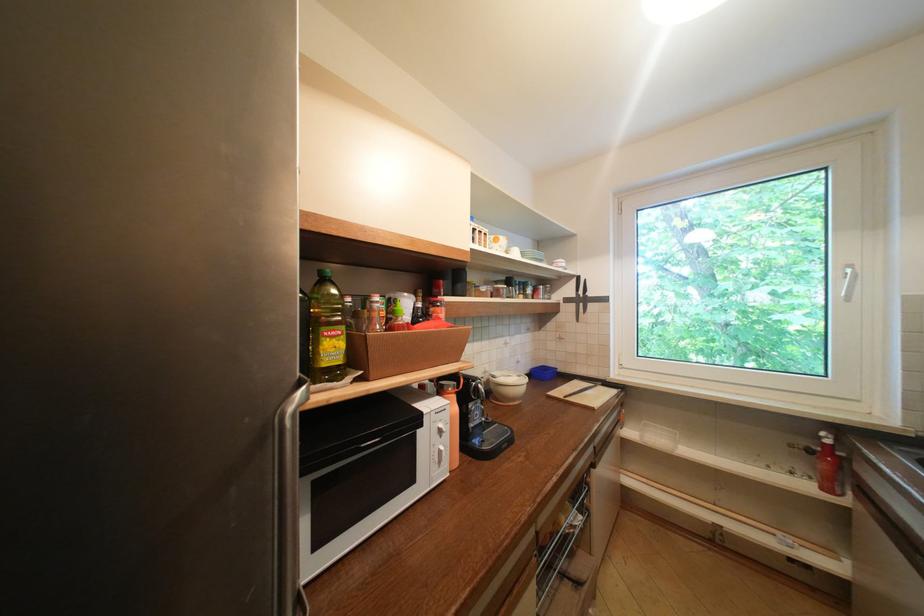
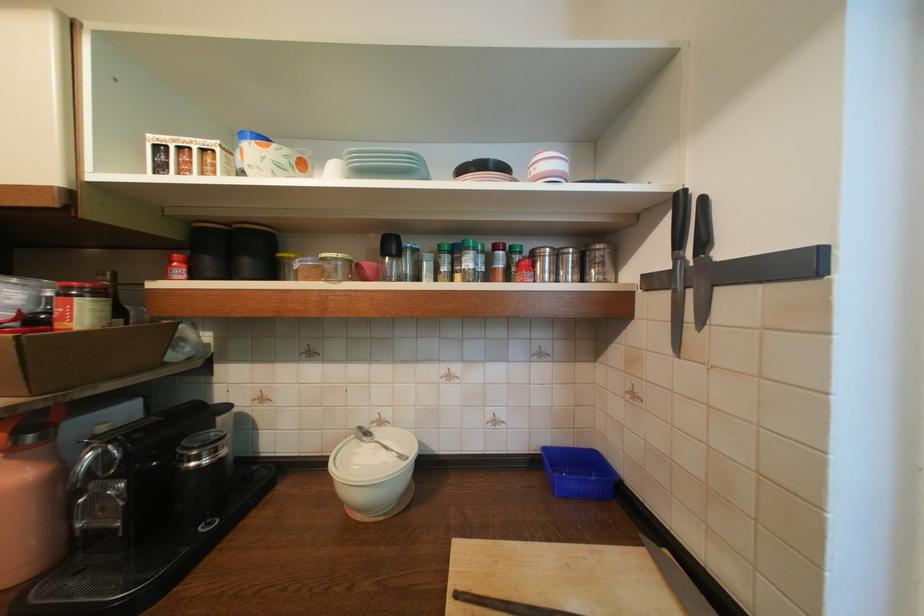
Where in the second image is the point corresponding to pixel 446 306 from the first image?

(82, 294)